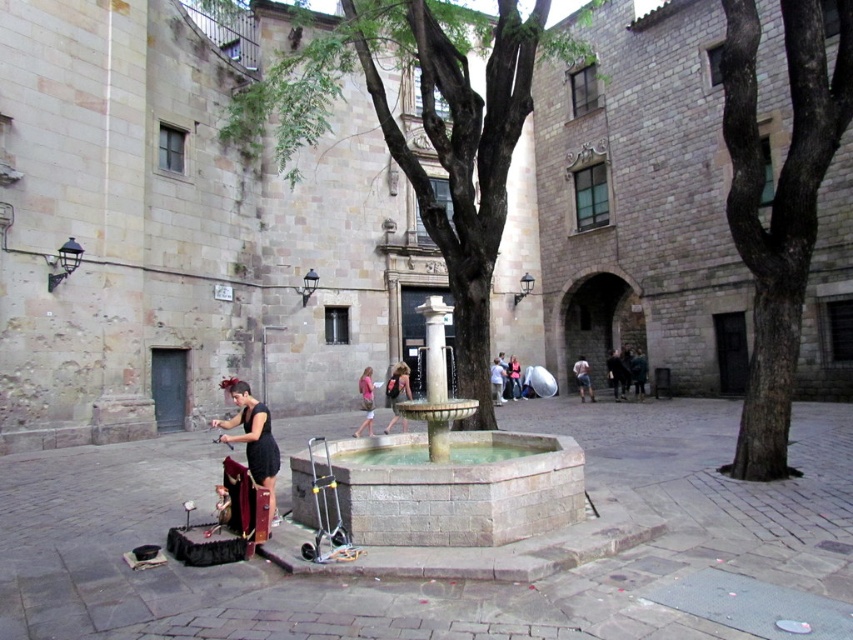
You are standing in the urban square and notice the green leafy tree at center and the smooth gray bark at center. Which object is located to the left of the other?

The green leafy tree at center is positioned on the left side of smooth gray bark at center.

You are standing in the urban square and want to take a photo of the green leafy tree at center and the smooth gray bark at center. Which object should you focus on first if you want to capture both in one frame without moving the camera?

You should focus on the green leafy tree at center first because it is above the smooth gray bark at center, so adjusting the camera to include the tree will naturally include the bark below it.

You are standing in the urban square and want to locate the smooth gray bark at center. According to the coordinates provided, where exactly should you look?

The smooth gray bark at center is located at the coordinates point (778, 205).